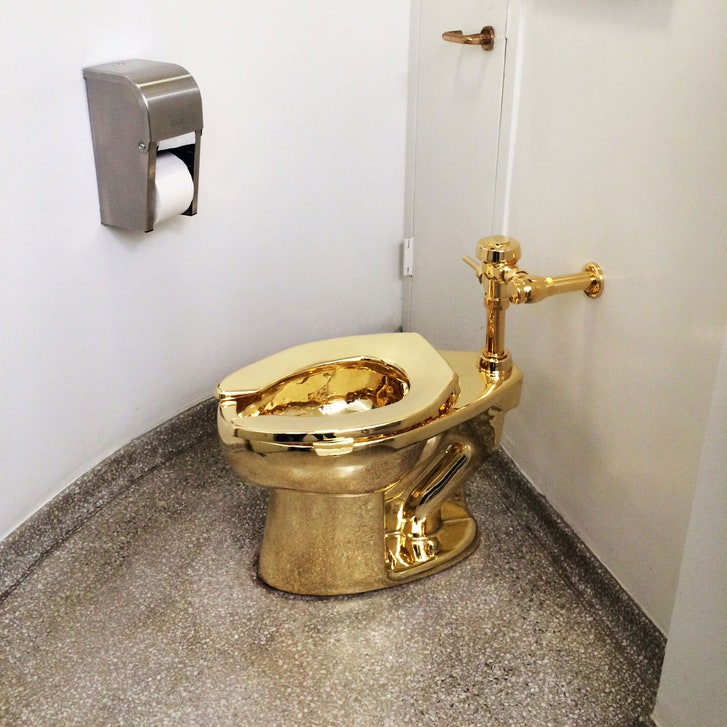
The image size is (727, 727). Find the location of `switch`. switch is located at coordinates (472, 264).